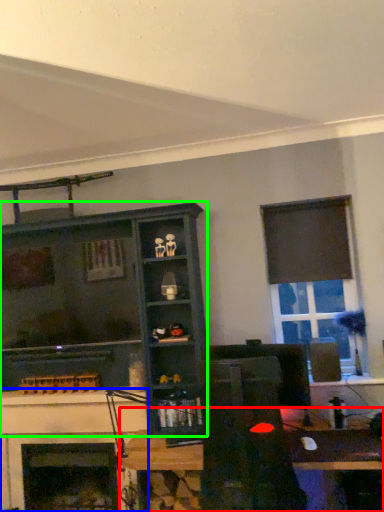
Question: Estimate the real-world distances between objects in this image. Which object is closer to table (highlighted by a red box), fireplace (highlighted by a blue box) or shelf (highlighted by a green box)?

Choices:
 (A) fireplace
 (B) shelf

Answer: (B)